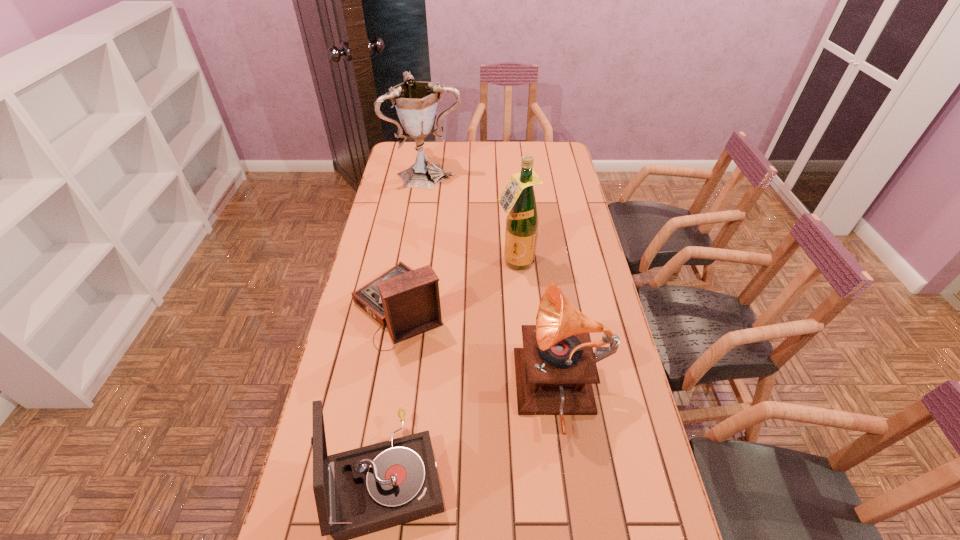
What are the coordinates of `trophy cup` in the screenshot? It's located at (416, 102).

Where is `liquor`? The image size is (960, 540). liquor is located at coordinates (517, 199).

You are a GUI agent. You are given a task and a screenshot of the screen. Output one action in this format:
    pyautogui.click(x=<x>, y=<y>)
    Task: Click on the third shortest object
    
    Given the screenshot: What is the action you would take?
    pyautogui.click(x=555, y=369)

You are a GUI agent. You are given a task and a screenshot of the screen. Output one action in this format:
    pyautogui.click(x=<x>, y=<y>)
    Task: Click on the rightmost phonograph record
    Image resolution: width=960 pixels, height=540 pixels.
    Given the screenshot: What is the action you would take?
    pyautogui.click(x=555, y=369)

Where is `the shortest phonograph record`? the shortest phonograph record is located at coordinates (407, 301).

Find the location of a particular element. This screenshot has width=960, height=540. free spot located on the back of the trophy cup is located at coordinates (433, 145).

The height and width of the screenshot is (540, 960). What are the coordinates of `free space located 0.270m on the front-facing side of the liquor` in the screenshot? It's located at (521, 335).

The height and width of the screenshot is (540, 960). I want to click on free region located on the horn of the tallest phonograph record, so click(444, 394).

The width and height of the screenshot is (960, 540). Identify the location of free space located 0.300m on the horn of the tallest phonograph record. (408, 394).

This screenshot has width=960, height=540. I want to click on free space located 0.340m on the horn of the tallest phonograph record, so click(x=394, y=394).